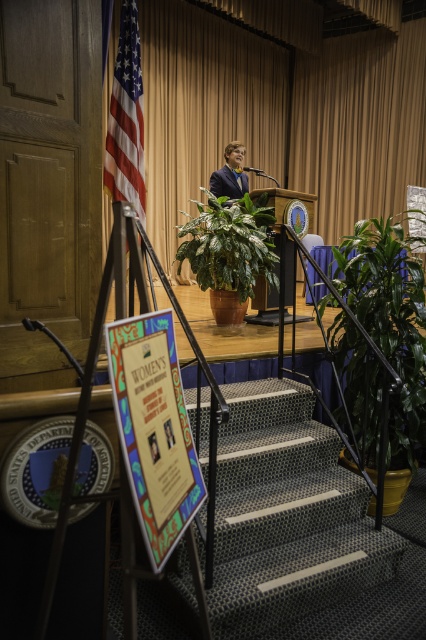
Who is positioned more to the left, green carpeted stairs at center or red-white-striped flag at left?

red-white-striped flag at left

From the picture: Does green carpeted stairs at center appear over red-white-striped flag at left?

Incorrect, green carpeted stairs at center is not positioned above red-white-striped flag at left.

Who is more forward, (x=291, y=582) or (x=103, y=28)?

Answer: Positioned in front is point (x=291, y=582).

Image resolution: width=426 pixels, height=640 pixels. Identify the location of green carpeted stairs at center. (299, 525).

Can you confirm if matte gold curtain at upper center is positioned below green glossy plant at center?

No.

Which of these two, matte gold curtain at upper center or green glossy plant at center, stands shorter?

matte gold curtain at upper center is shorter.

From the picture: Who is more distant from viewer, (x=160, y=67) or (x=218, y=260)?

Positioned behind is point (x=160, y=67).

This screenshot has width=426, height=640. Identify the location of matte gold curtain at upper center. (204, 106).

Who is shorter, green leafy plant at center or matte blue suit at center?

With less height is matte blue suit at center.

Can you confirm if green leafy plant at center is positioned to the right of matte blue suit at center?

Yes, green leafy plant at center is to the right of matte blue suit at center.

Image resolution: width=426 pixels, height=640 pixels. What are the coordinates of `green leafy plant at center` in the screenshot? It's located at coord(388,321).

The width and height of the screenshot is (426, 640). In order to click on green leafy plant at center in this screenshot , I will do `click(388, 321)`.